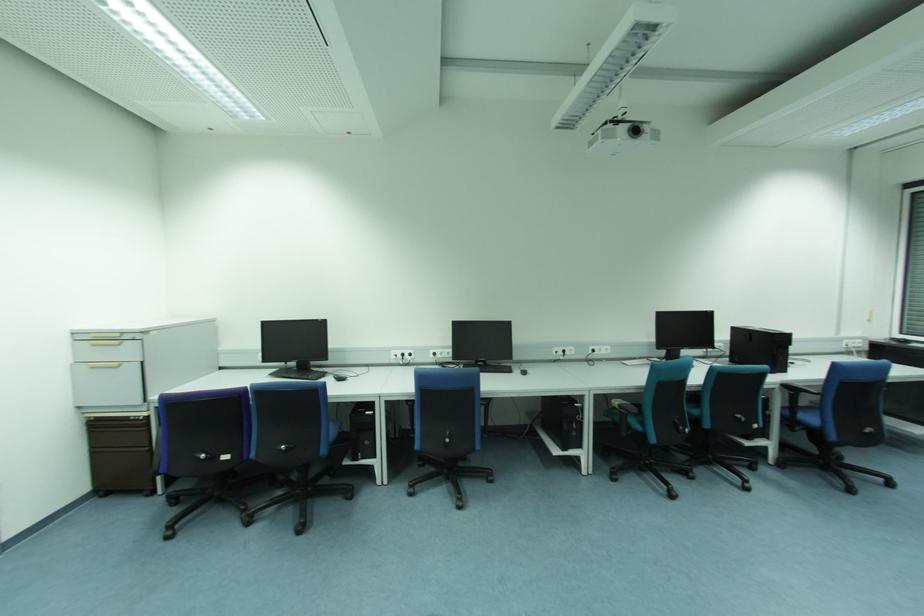
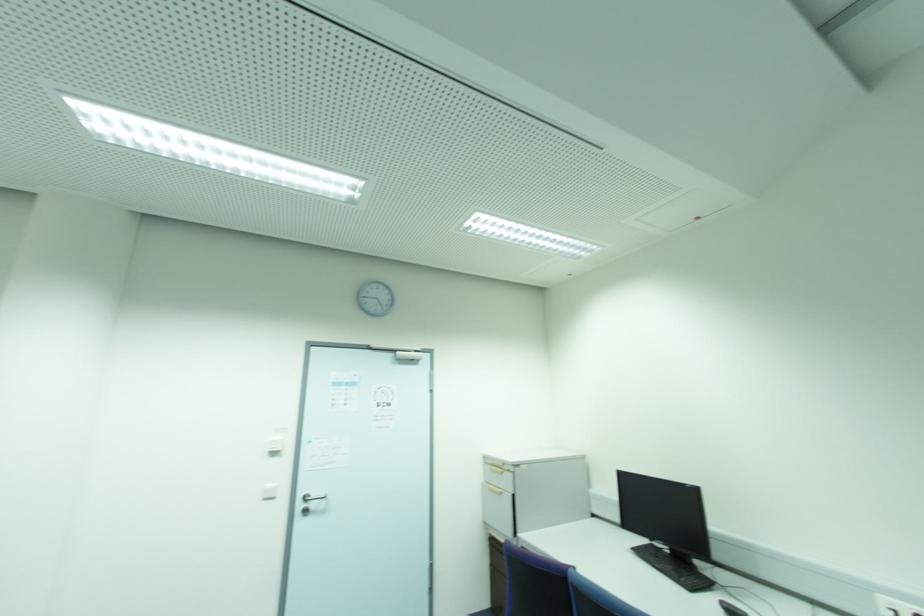
In the second image, find the point that corresponds to (x=335, y=379) in the first image.

(723, 610)